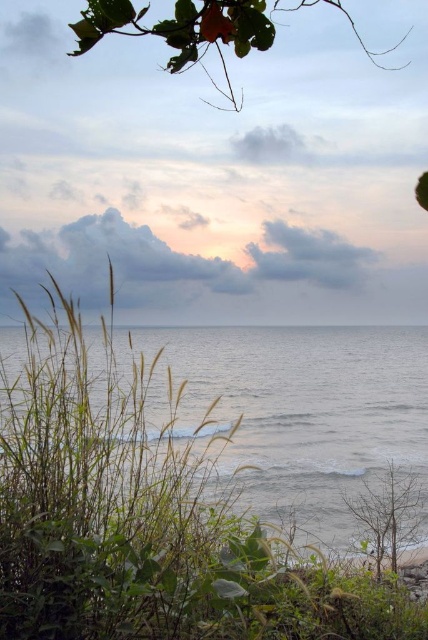
Between gray matte water at center and green leafy branch at upper center, which one has more height?

green leafy branch at upper center

Who is positioned more to the right, gray matte water at center or green leafy branch at upper center?

From the viewer's perspective, green leafy branch at upper center appears more on the right side.

Locate an element on the screen. The height and width of the screenshot is (640, 428). gray matte water at center is located at coordinates [x=299, y=412].